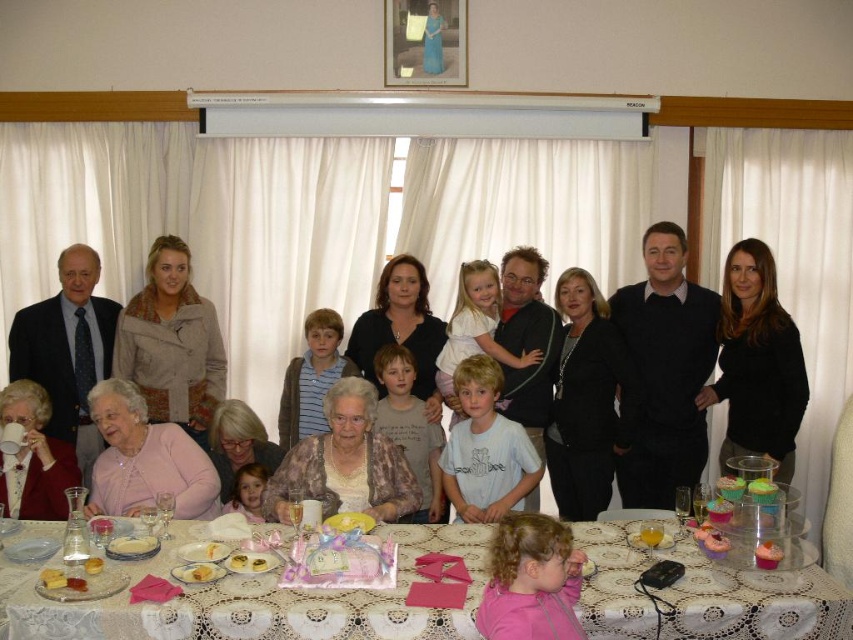
Who is lower down, matte black cake at center or matte black suit at left?

Positioned lower is matte black cake at center.

Does matte black cake at center lie in front of matte black suit at left?

Yes.

Is point (635, 525) positioned in front of point (79, 362)?

Yes.

Find the location of a particular element. matte black cake at center is located at coordinates click(260, 604).

In order to click on matte black cake at center in this screenshot , I will do `click(260, 604)`.

In order to click on matte black cake at center in this screenshot , I will do `click(260, 604)`.

Which is below, floral-patterned dress at center or matte black mug at lower left?

Positioned lower is floral-patterned dress at center.

Is floral-patterned dress at center above matte black mug at lower left?

Incorrect, floral-patterned dress at center is not positioned above matte black mug at lower left.

This screenshot has height=640, width=853. Describe the element at coordinates (345, 461) in the screenshot. I see `floral-patterned dress at center` at that location.

Where is `floral-patterned dress at center`? This screenshot has height=640, width=853. floral-patterned dress at center is located at coordinates (345, 461).